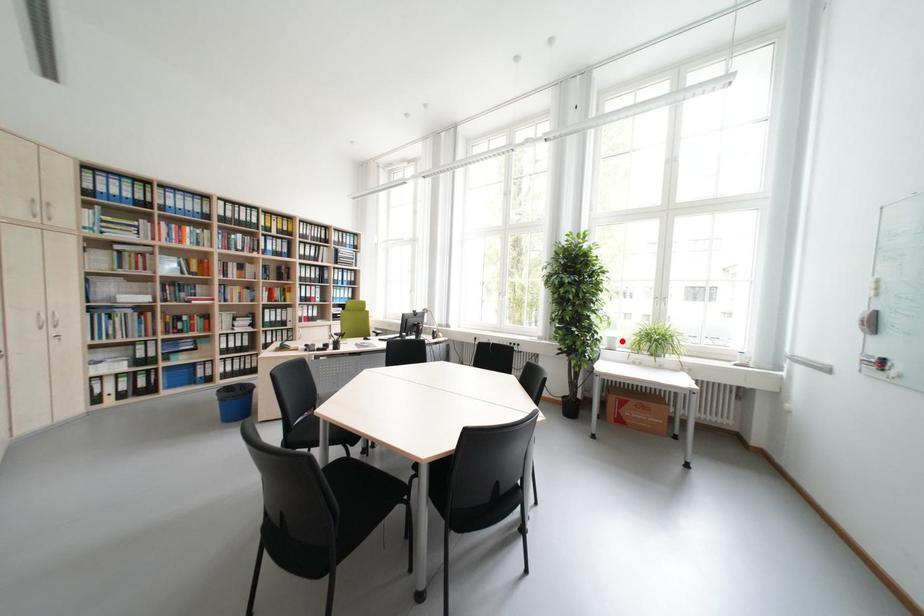
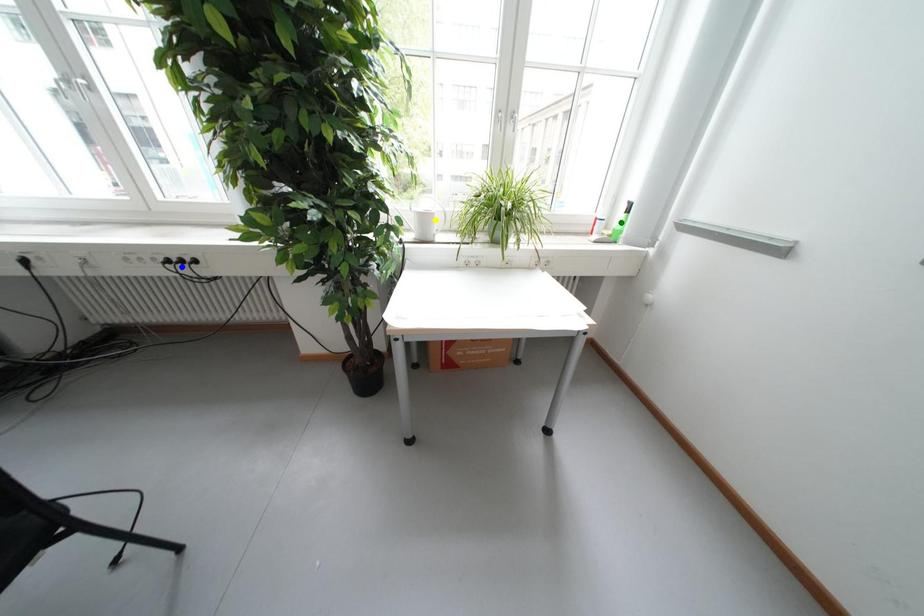
Question: I am providing you with two images of the same scene from different viewpoints. A red point is marked on the first image. You are given multiple points on the second image. Which point in image 2 represents the same 3d spot as the red point in image 1?

Choices:
 (A) yellow point
 (B) blue point
 (C) green point

Answer: (A)